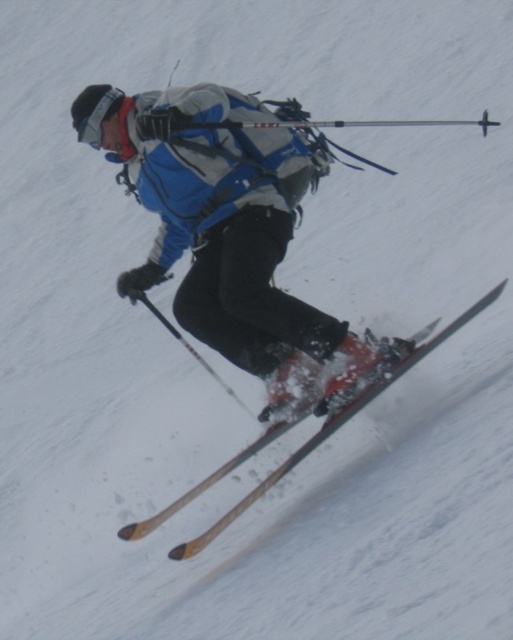
You are a photographer trying to capture the skier in the image. You want to focus on the point that is closer to you. Which point should you choose between point (122, 134) and point (167, 324)?

Point (167, 324) is closer to you than point (122, 134), so you should choose point (167, 324) to focus on the point that is closer to you.